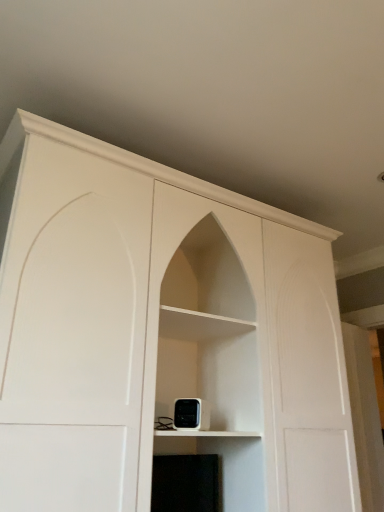
This screenshot has width=384, height=512. Describe the element at coordinates (161, 334) in the screenshot. I see `white matte cabinet at center` at that location.

The height and width of the screenshot is (512, 384). What are the coordinates of `white matte cabinet at center` in the screenshot? It's located at (161, 334).

Identify the location of white matte cabinet at center. (161, 334).